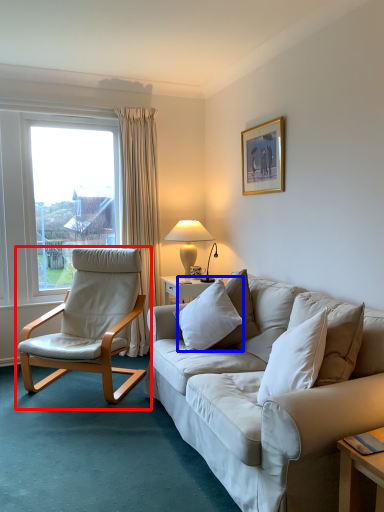
Question: Which of the following is the closest to the observer, chair (highlighted by a red box) or pillow (highlighted by a blue box)?

Choices:
 (A) chair
 (B) pillow

Answer: (B)